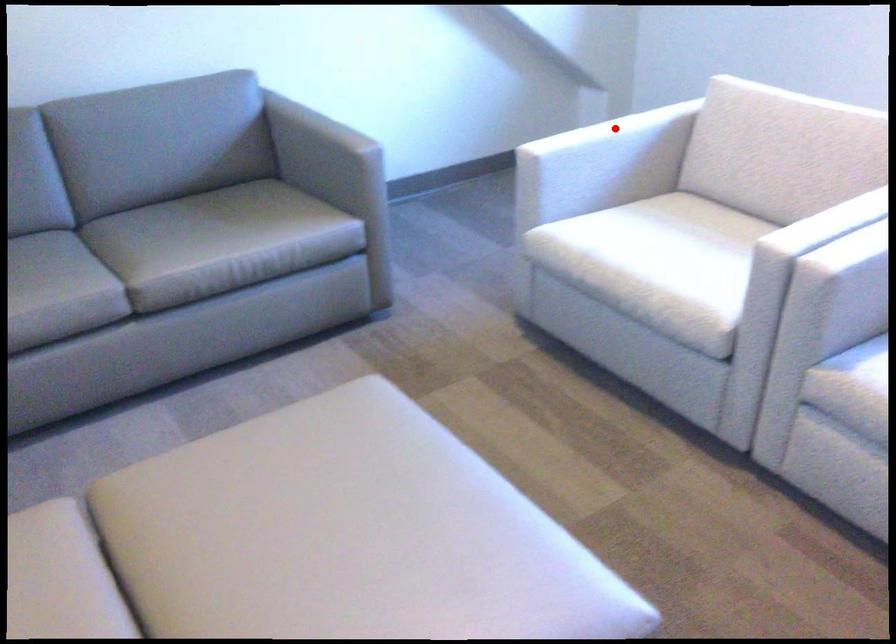
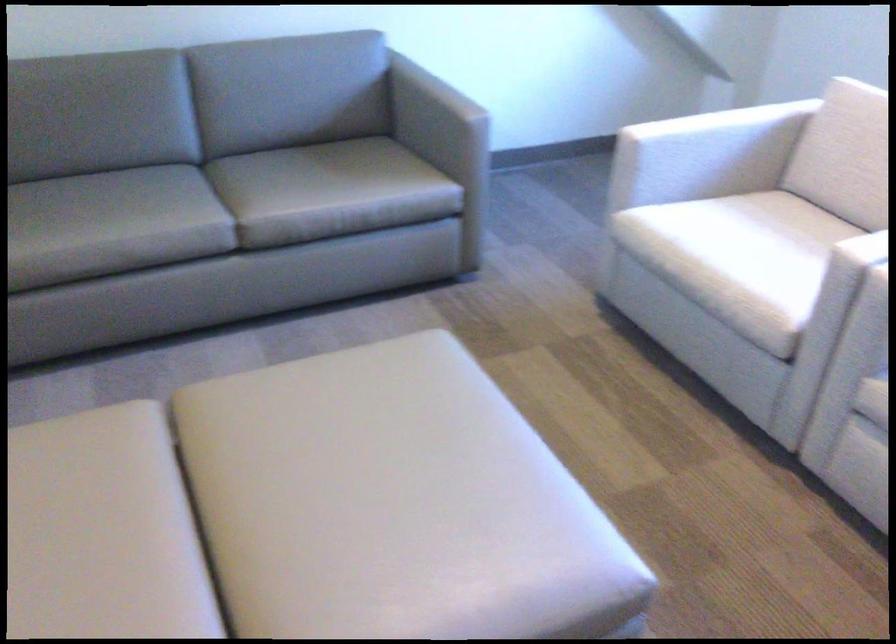
In the second image, find the point that corresponds to the highlighted location in the first image.

(719, 120)